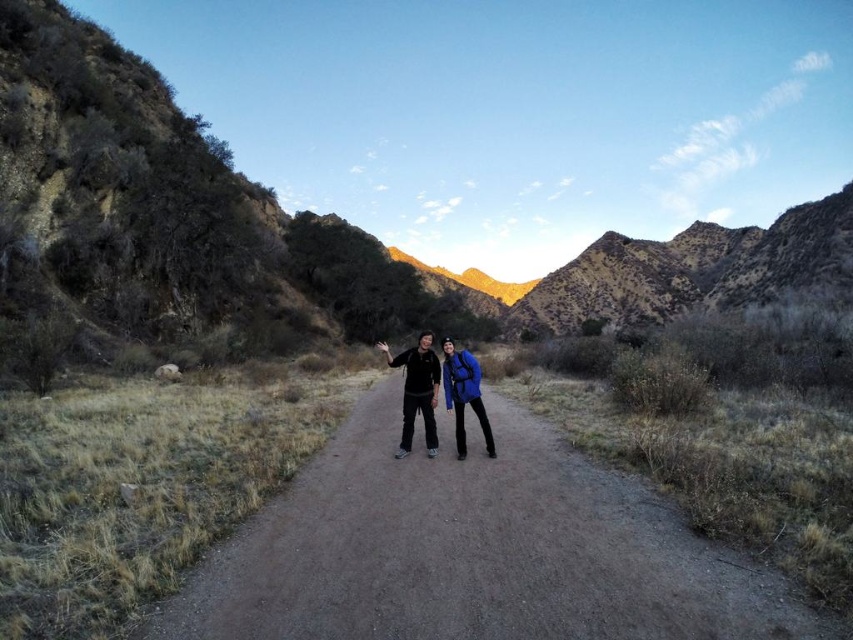
Can you confirm if matte black jacket at center is wider than blue fabric backpack at center?

Indeed, matte black jacket at center has a greater width compared to blue fabric backpack at center.

Does matte black jacket at center have a greater height compared to blue fabric backpack at center?

Yes, matte black jacket at center is taller than blue fabric backpack at center.

The image size is (853, 640). What are the coordinates of `matte black jacket at center` in the screenshot? It's located at (437, 392).

Where is `matte black jacket at center`? Image resolution: width=853 pixels, height=640 pixels. matte black jacket at center is located at coordinates (437, 392).

Does brown rocky mountain at center have a lesser height compared to brown dirt track at center?

No.

Is brown rocky mountain at center positioned at the back of brown dirt track at center?

That is True.

Is point (315, 225) less distant than point (344, 452)?

No, it is behind (344, 452).

At what (x,y) coordinates should I click in order to perform the action: click on brown rocky mountain at center. Please return your answer as a coordinate pair (x, y). This screenshot has width=853, height=640. Looking at the image, I should click on (300, 227).

Can you confirm if brown rocky mountain at center is positioned above blue fabric backpack at center?

Yes, brown rocky mountain at center is above blue fabric backpack at center.

Is brown rocky mountain at center to the left of blue fabric backpack at center from the viewer's perspective?

No, brown rocky mountain at center is not to the left of blue fabric backpack at center.

Find the location of a particular element. Image resolution: width=853 pixels, height=640 pixels. brown rocky mountain at center is located at coordinates (300, 227).